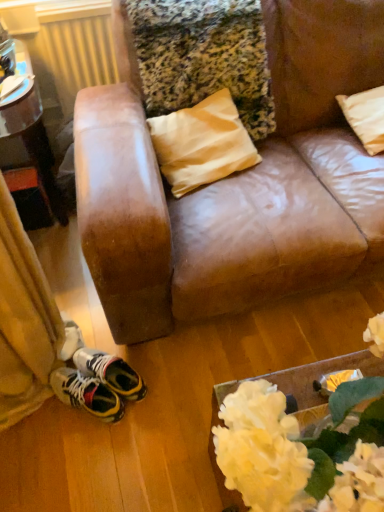
Question: Is white fabric flowers at lower right at the left side of beige fabric pillow at upper right?

Choices:
 (A) yes
 (B) no

Answer: (A)

Question: Is white fabric flowers at lower right aimed at beige fabric pillow at upper right?

Choices:
 (A) no
 (B) yes

Answer: (A)

Question: Does white fabric flowers at lower right have a lesser height compared to beige fabric pillow at upper right?

Choices:
 (A) no
 (B) yes

Answer: (A)

Question: Is white fabric flowers at lower right in front of beige fabric pillow at upper right?

Choices:
 (A) yes
 (B) no

Answer: (A)

Question: Would you say white fabric flowers at lower right is outside beige fabric pillow at upper right?

Choices:
 (A) no
 (B) yes

Answer: (B)

Question: Is white fabric flowers at lower right bigger than beige fabric pillow at upper right?

Choices:
 (A) yes
 (B) no

Answer: (A)

Question: Does beige fabric pillow at upper right have a lesser height compared to white fabric flowers at lower right?

Choices:
 (A) yes
 (B) no

Answer: (A)

Question: Is beige fabric pillow at upper right far from white fabric flowers at lower right?

Choices:
 (A) no
 (B) yes

Answer: (B)

Question: Does beige fabric pillow at upper right touch white fabric flowers at lower right?

Choices:
 (A) no
 (B) yes

Answer: (A)

Question: Considering the relative sizes of beige fabric pillow at upper right and white fabric flowers at lower right in the image provided, is beige fabric pillow at upper right taller than white fabric flowers at lower right?

Choices:
 (A) no
 (B) yes

Answer: (A)

Question: Could you tell me if beige fabric pillow at upper right is turned towards white fabric flowers at lower right?

Choices:
 (A) no
 (B) yes

Answer: (A)

Question: From the image's perspective, does beige fabric pillow at upper right appear lower than white fabric flowers at lower right?

Choices:
 (A) yes
 (B) no

Answer: (B)

Question: Considering the relative positions of metallic yellow radiator at upper left and brushed metal table at left in the image provided, is metallic yellow radiator at upper left to the left of brushed metal table at left from the viewer's perspective?

Choices:
 (A) yes
 (B) no

Answer: (B)